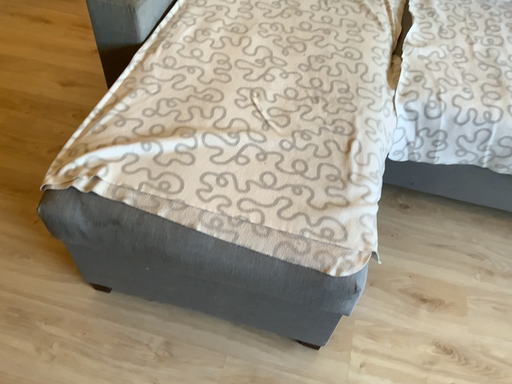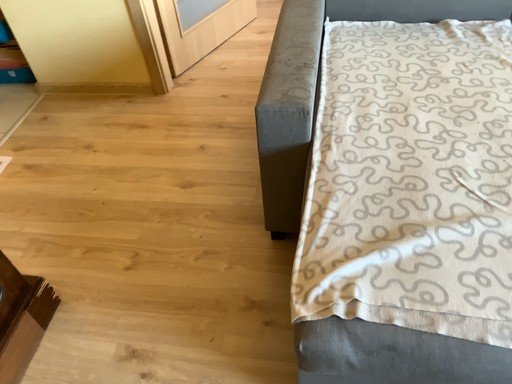
Question: Which way did the camera rotate in the video?

Choices:
 (A) rotated upward
 (B) rotated downward

Answer: (A)